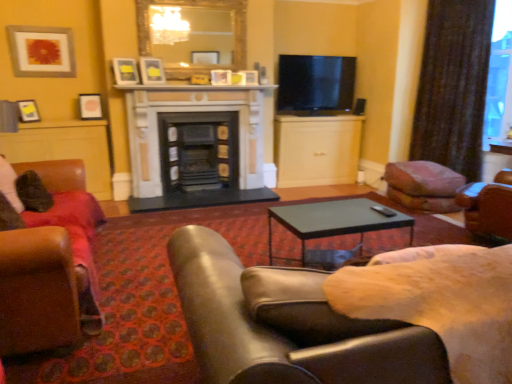
Find the location of a particular element. The height and width of the screenshot is (384, 512). vacant space underneath matte gray picture frame at upper left, which appears as the first picture frame when viewed from the left (from a real-world perspective) is located at coordinates point(58,113).